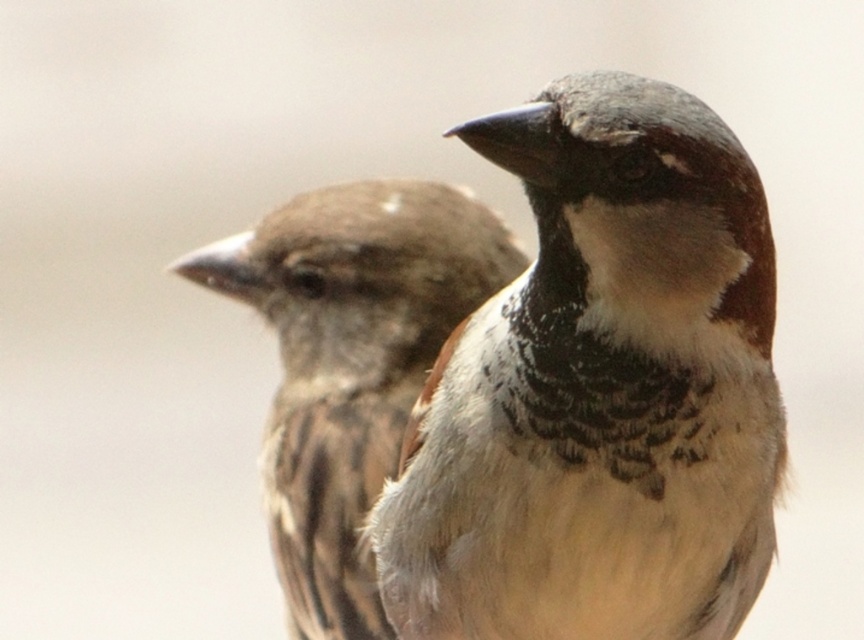
Is point (399, 612) positioned after point (397, 273)?

That is False.

Is brown speckled feathers at center in front of brown feathered sparrow at left?

That is True.

Who is more forward, (x=710, y=412) or (x=329, y=280)?

Point (x=710, y=412) is in front.

Where is `brown speckled feathers at center`? brown speckled feathers at center is located at coordinates (600, 392).